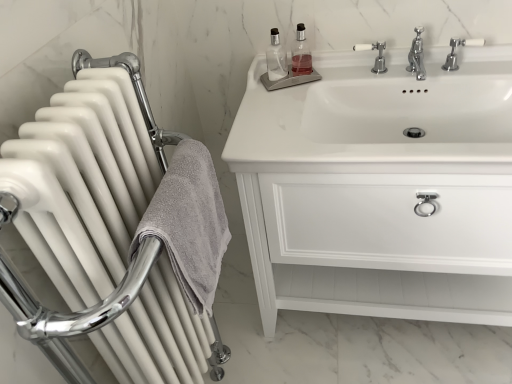
Question: Is white glossy cabinet at upper right in contact with white glossy radiator at left?

Choices:
 (A) yes
 (B) no

Answer: (B)

Question: Is white glossy radiator at left at the back of white glossy cabinet at upper right?

Choices:
 (A) yes
 (B) no

Answer: (B)

Question: Is white glossy cabinet at upper right taller than white glossy radiator at left?

Choices:
 (A) no
 (B) yes

Answer: (A)

Question: Is the depth of white glossy cabinet at upper right less than that of white glossy radiator at left?

Choices:
 (A) yes
 (B) no

Answer: (B)

Question: Considering the relative sizes of white glossy cabinet at upper right and white glossy radiator at left in the image provided, is white glossy cabinet at upper right bigger than white glossy radiator at left?

Choices:
 (A) yes
 (B) no

Answer: (A)

Question: In terms of height, does white ceramic tap at upper center, the first tap positioned from the left, look taller or shorter compared to white plastic tap at upper right, marked as the 2th tap in a left-to-right arrangement?

Choices:
 (A) short
 (B) tall

Answer: (A)

Question: Is point (377, 72) closer or farther from the camera than point (458, 66)?

Choices:
 (A) farther
 (B) closer

Answer: (A)

Question: From the image's perspective, is white ceramic tap at upper center, the first tap positioned from the left, above or below white plastic tap at upper right, arranged as the 1th tap when viewed from the right?

Choices:
 (A) below
 (B) above

Answer: (B)

Question: Would you say white ceramic tap at upper center, the first tap positioned from the left, is to the left or to the right of white plastic tap at upper right, arranged as the 1th tap when viewed from the right, in the picture?

Choices:
 (A) left
 (B) right

Answer: (A)

Question: Considering the positions of white glossy radiator at left and white ceramic tap at upper center, which appears as the second tap when viewed from the right, in the image, is white glossy radiator at left taller or shorter than white ceramic tap at upper center, which appears as the second tap when viewed from the right,?

Choices:
 (A) short
 (B) tall

Answer: (B)

Question: In terms of width, does white glossy radiator at left look wider or thinner when compared to white ceramic tap at upper center, the first tap positioned from the left?

Choices:
 (A) thin
 (B) wide

Answer: (B)

Question: Which is correct: white glossy radiator at left is inside white ceramic tap at upper center, the first tap positioned from the left, or outside of it?

Choices:
 (A) outside
 (B) inside

Answer: (A)

Question: In the image, is white glossy radiator at left positioned in front of or behind white ceramic tap at upper center, the first tap positioned from the left?

Choices:
 (A) front
 (B) behind

Answer: (A)

Question: Is white glossy cabinet at upper right bigger or smaller than clear glass bottle at upper center?

Choices:
 (A) big
 (B) small

Answer: (A)

Question: Is white glossy cabinet at upper right in front of or behind clear glass bottle at upper center in the image?

Choices:
 (A) front
 (B) behind

Answer: (A)